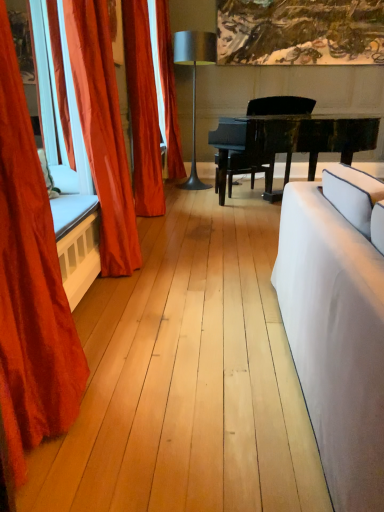
The width and height of the screenshot is (384, 512). Find the location of `spots to the right of satin orange curtain at left, the 2th curtain in the front-to-back sequence`. spots to the right of satin orange curtain at left, the 2th curtain in the front-to-back sequence is located at coordinates (183, 267).